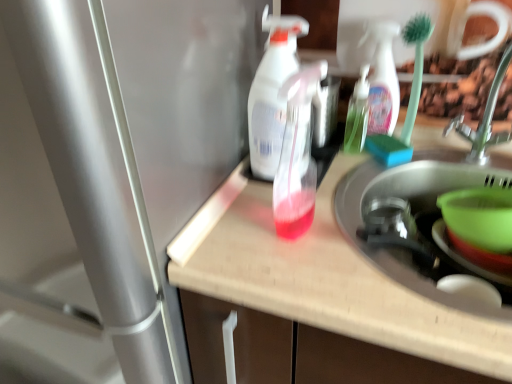
Image resolution: width=512 pixels, height=384 pixels. I want to click on free space between translucent plastic spray bottle at center, the second bottle in the back-to-front sequence, and green plastic brush at upper right, so click(x=348, y=191).